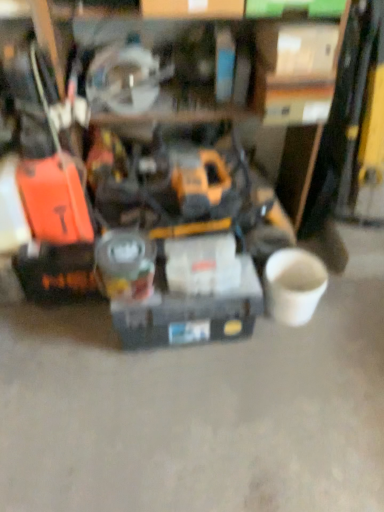
The image size is (384, 512). I want to click on yellow/black plastic drill at center, so click(x=124, y=196).

The image size is (384, 512). What do you see at coordinates (297, 48) in the screenshot? I see `white cardboard box at upper center, which is counted as the 2th box, starting from the bottom` at bounding box center [297, 48].

This screenshot has width=384, height=512. What do you see at coordinates (191, 315) in the screenshot?
I see `matte gray toolbox at center, which is the second box in top-to-bottom order` at bounding box center [191, 315].

Where is `yellow/black plastic drill at center`? yellow/black plastic drill at center is located at coordinates (124, 196).

In terms of width, does matte gray toolbox at center, positioned as the first box in bottom-to-top order, look wider or thinner when compared to white cardboard box at upper center, which ranks as the second box in left-to-right order?

Clearly, matte gray toolbox at center, positioned as the first box in bottom-to-top order, has less width compared to white cardboard box at upper center, which ranks as the second box in left-to-right order.

Which of these two, matte gray toolbox at center, the 2th box in the right-to-left sequence, or white cardboard box at upper center, which ranks as the second box in left-to-right order, is smaller?

Smaller between the two is white cardboard box at upper center, which ranks as the second box in left-to-right order.

From the image's perspective, which object appears higher, matte gray toolbox at center, which is the second box in top-to-bottom order, or white cardboard box at upper center, which ranks as the second box in left-to-right order?

white cardboard box at upper center, which ranks as the second box in left-to-right order, from the image's perspective.

Is matte gray toolbox at center, positioned as the first box in bottom-to-top order, in contact with white cardboard box at upper center, which is the first box in right-to-left order?

matte gray toolbox at center, positioned as the first box in bottom-to-top order, and white cardboard box at upper center, which is the first box in right-to-left order, are clearly separated.

From the image's perspective, which one is positioned lower, white cardboard box at upper center, which is counted as the 2th box, starting from the bottom, or matte gray toolbox at center, the 2th box in the right-to-left sequence?

matte gray toolbox at center, the 2th box in the right-to-left sequence, from the image's perspective.

Between white cardboard box at upper center, which is counted as the 2th box, starting from the bottom, and matte gray toolbox at center, the first box from the left, which one has larger size?

matte gray toolbox at center, the first box from the left, is bigger.

This screenshot has height=512, width=384. Identify the location of box that appears in front of the matte gray toolbox at center, positioned as the first box in bottom-to-top order. (297, 48).

Do you think white cardboard box at upper center, which is the first box in right-to-left order, is within matte gray toolbox at center, the 2th box in the right-to-left sequence, or outside of it?

white cardboard box at upper center, which is the first box in right-to-left order, is not enclosed by matte gray toolbox at center, the 2th box in the right-to-left sequence.

Are yellow/black plastic drill at center and matte gray toolbox at center, the first box from the left, beside each other?

No, yellow/black plastic drill at center is not with matte gray toolbox at center, the first box from the left.

Is yellow/black plastic drill at center oriented away from matte gray toolbox at center, the first box from the left?

No, matte gray toolbox at center, the first box from the left, is not at the back of yellow/black plastic drill at center.

Considering the positions of objects yellow/black plastic drill at center and matte gray toolbox at center, the 2th box in the right-to-left sequence, in the image provided, who is more to the right, yellow/black plastic drill at center or matte gray toolbox at center, the 2th box in the right-to-left sequence,?

yellow/black plastic drill at center.

From the image's perspective, which is below, yellow/black plastic drill at center or matte gray toolbox at center, which is the second box in top-to-bottom order?

matte gray toolbox at center, which is the second box in top-to-bottom order.

Is matte gray toolbox at center, which is the second box in top-to-bottom order, in front of or behind yellow/black plastic drill at center in the image?

In the image, matte gray toolbox at center, which is the second box in top-to-bottom order, appears behind yellow/black plastic drill at center.

Is yellow/black plastic drill at center at the back of matte gray toolbox at center, the 2th box in the right-to-left sequence?

That's right, matte gray toolbox at center, the 2th box in the right-to-left sequence, is facing away from yellow/black plastic drill at center.

Considering the sizes of objects matte gray toolbox at center, positioned as the first box in bottom-to-top order, and yellow/black plastic drill at center in the image provided, who is bigger, matte gray toolbox at center, positioned as the first box in bottom-to-top order, or yellow/black plastic drill at center?

With larger size is yellow/black plastic drill at center.

Which is correct: yellow/black plastic drill at center is inside white cardboard box at upper center, which ranks as the second box in left-to-right order, or outside of it?

The correct answer is: outside.

How far apart are yellow/black plastic drill at center and white cardboard box at upper center, the first box from the top?

yellow/black plastic drill at center is 23.69 inches from white cardboard box at upper center, the first box from the top.

Consider the image. What's the angular difference between yellow/black plastic drill at center and white cardboard box at upper center, the first box from the top,'s facing directions?

4.31 degrees separate the facing orientations of yellow/black plastic drill at center and white cardboard box at upper center, the first box from the top.

Find the location of a particular element. tool located on the left of white cardboard box at upper center, which is counted as the 2th box, starting from the bottom is located at coordinates (124, 196).

Is white cardboard box at upper center, which ranks as the second box in left-to-right order, smaller than yellow/black plastic drill at center?

Indeed, white cardboard box at upper center, which ranks as the second box in left-to-right order, has a smaller size compared to yellow/black plastic drill at center.

In the scene shown: From the image's perspective, would you say white cardboard box at upper center, which is counted as the 2th box, starting from the bottom, is shown under yellow/black plastic drill at center?

No.

Can you confirm if white cardboard box at upper center, the first box from the top, is shorter than yellow/black plastic drill at center?

Yes, white cardboard box at upper center, the first box from the top, is shorter than yellow/black plastic drill at center.

This screenshot has width=384, height=512. In order to click on tool that appears below the white cardboard box at upper center, which is the first box in right-to-left order (from the image's perspective) in this screenshot , I will do `click(124, 196)`.

Where is `box that appears in front of the matte gray toolbox at center, positioned as the first box in bottom-to-top order`? This screenshot has height=512, width=384. box that appears in front of the matte gray toolbox at center, positioned as the first box in bottom-to-top order is located at coordinates [x=297, y=48].

Locate an element on the screen. The image size is (384, 512). box that appears on the left of white cardboard box at upper center, the first box from the top is located at coordinates 191,315.

From the image, which object appears to be nearer to matte gray toolbox at center, the first box from the left, yellow/black plastic drill at center or white cardboard box at upper center, which ranks as the second box in left-to-right order?

yellow/black plastic drill at center.

Looking at the image, which one is located closer to matte gray toolbox at center, positioned as the first box in bottom-to-top order, white cardboard box at upper center, the first box from the top, or yellow/black plastic drill at center?

yellow/black plastic drill at center is positioned closer to the anchor matte gray toolbox at center, positioned as the first box in bottom-to-top order.

Looking at the image, which one is located further to white cardboard box at upper center, which is the first box in right-to-left order, matte gray toolbox at center, which is the second box in top-to-bottom order, or yellow/black plastic drill at center?

matte gray toolbox at center, which is the second box in top-to-bottom order, is further to white cardboard box at upper center, which is the first box in right-to-left order.

From the image, which object appears to be farther from white cardboard box at upper center, which is counted as the 2th box, starting from the bottom, yellow/black plastic drill at center or matte gray toolbox at center, which is the second box in top-to-bottom order?

matte gray toolbox at center, which is the second box in top-to-bottom order, is positioned further to the anchor white cardboard box at upper center, which is counted as the 2th box, starting from the bottom.

Based on their spatial positions, is white cardboard box at upper center, which is the first box in right-to-left order, or matte gray toolbox at center, the 2th box in the right-to-left sequence, further from yellow/black plastic drill at center?

Based on the image, white cardboard box at upper center, which is the first box in right-to-left order, appears to be further to yellow/black plastic drill at center.

Estimate the real-world distances between objects in this image. Which object is further from yellow/black plastic drill at center, matte gray toolbox at center, positioned as the first box in bottom-to-top order, or white cardboard box at upper center, which is counted as the 2th box, starting from the bottom?

white cardboard box at upper center, which is counted as the 2th box, starting from the bottom, is positioned further to the anchor yellow/black plastic drill at center.

The width and height of the screenshot is (384, 512). Find the location of `tool that lies between white cardboard box at upper center, which is counted as the 2th box, starting from the bottom, and matte gray toolbox at center, which is the second box in top-to-bottom order, from top to bottom`. tool that lies between white cardboard box at upper center, which is counted as the 2th box, starting from the bottom, and matte gray toolbox at center, which is the second box in top-to-bottom order, from top to bottom is located at coordinates (124, 196).